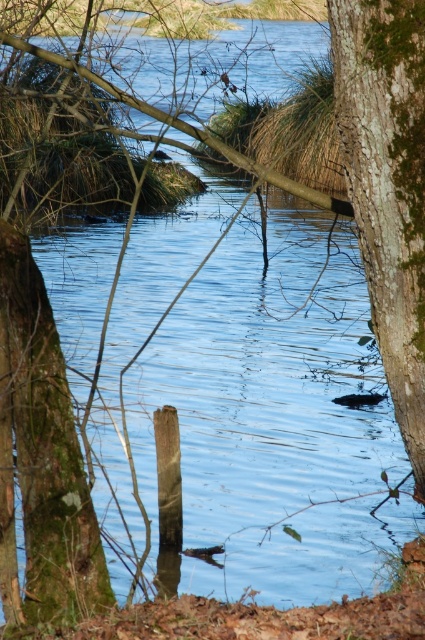
Question: Considering the relative positions of green mossy bark at right and green mossy tree trunk at lower left in the image provided, where is green mossy bark at right located with respect to green mossy tree trunk at lower left?

Choices:
 (A) right
 (B) left

Answer: (A)

Question: Does green mossy bark at right have a smaller size compared to green mossy tree trunk at lower left?

Choices:
 (A) yes
 (B) no

Answer: (B)

Question: Which point appears closest to the camera in this image?

Choices:
 (A) (373, 10)
 (B) (56, 502)

Answer: (A)

Question: Can you confirm if green mossy bark at right is thinner than green mossy tree trunk at lower left?

Choices:
 (A) no
 (B) yes

Answer: (A)